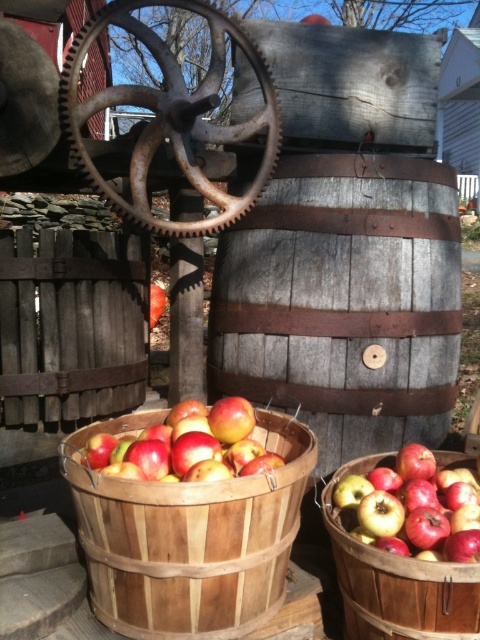
Question: Among these objects, which one is farthest from the camera?

Choices:
 (A) gray wooden barrel at center
 (B) shiny red apples at center
 (C) rusty metal gear at center
 (D) shiny red apples at lower right

Answer: (A)

Question: Does rusty metal gear at center lie behind shiny red apples at center?

Choices:
 (A) no
 (B) yes

Answer: (B)

Question: Observing the image, what is the correct spatial positioning of gray wooden barrel at center in reference to rusty metal gear at center?

Choices:
 (A) above
 (B) below

Answer: (B)

Question: Which point is closer to the camera?

Choices:
 (A) shiny red apples at center
 (B) rusty metal gear at center
 (C) gray wooden barrel at center
 (D) shiny red apples at lower right

Answer: (D)

Question: Based on their relative distances, which object is nearer to the shiny red apples at lower right?

Choices:
 (A) rusty metal gear at center
 (B) gray wooden barrel at center
 (C) shiny red apples at center

Answer: (C)

Question: Does rusty metal gear at center appear under shiny red apples at lower right?

Choices:
 (A) yes
 (B) no

Answer: (B)